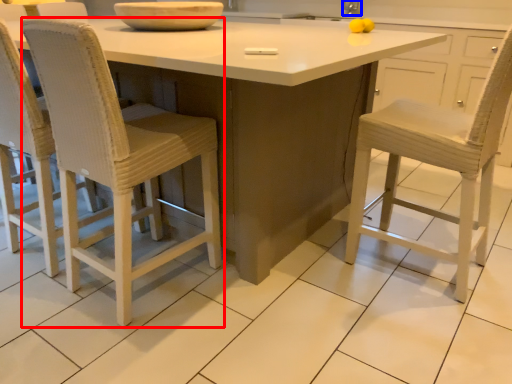
Question: Which point is closer to the camera, chair (highlighted by a red box) or faucet (highlighted by a blue box)?

Choices:
 (A) chair
 (B) faucet

Answer: (A)